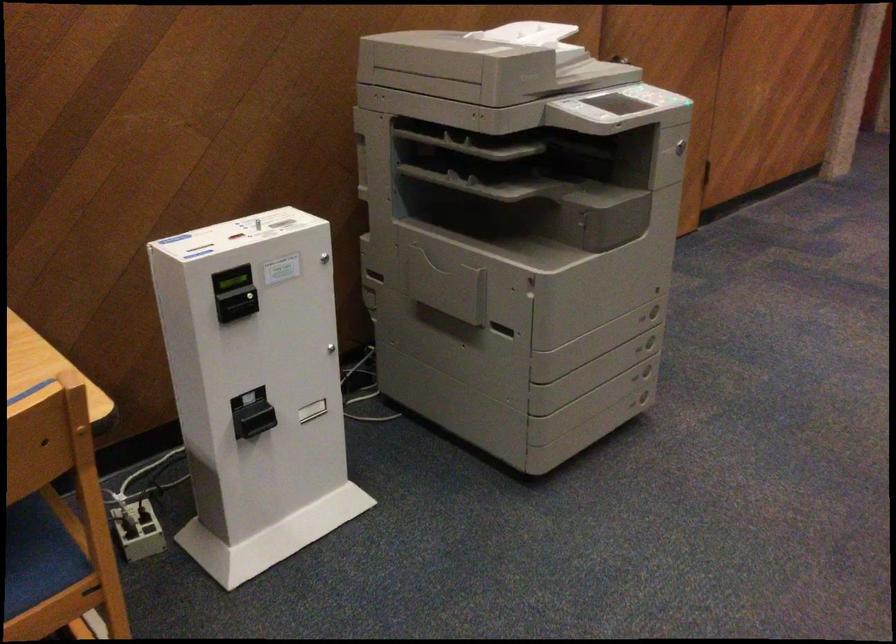
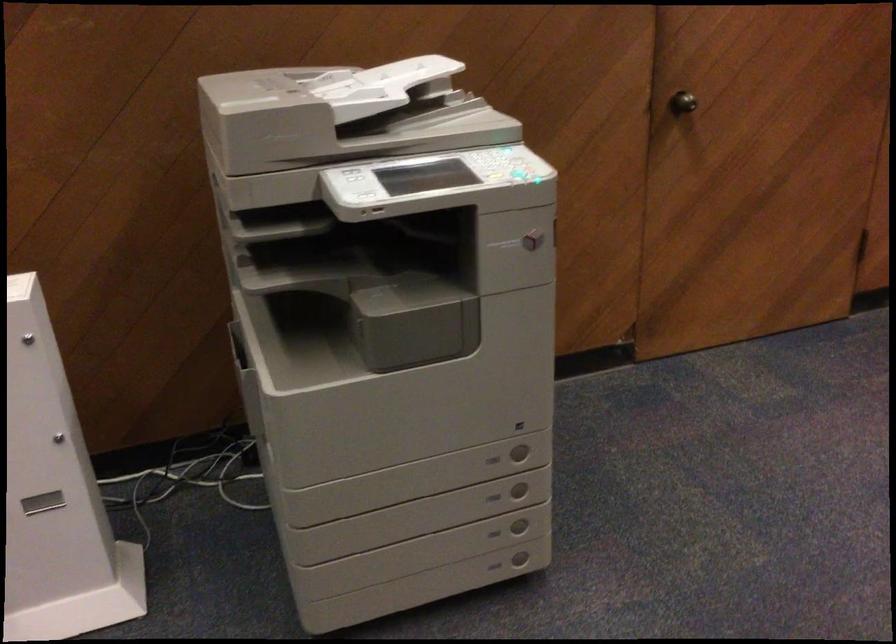
Find the pixel in the second image that matches point 644,316 in the first image.

(492, 459)